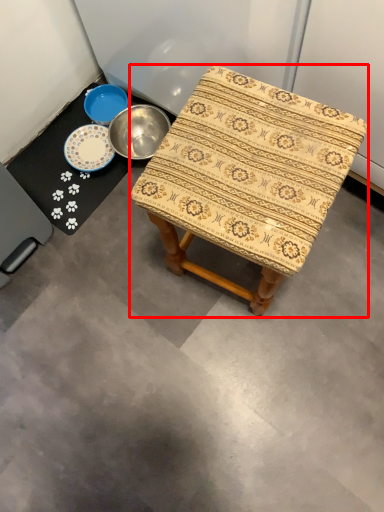
Question: From the image, what is the correct spatial relationship of stool (annotated by the red box) in relation to round table?

Choices:
 (A) right
 (B) left

Answer: (A)